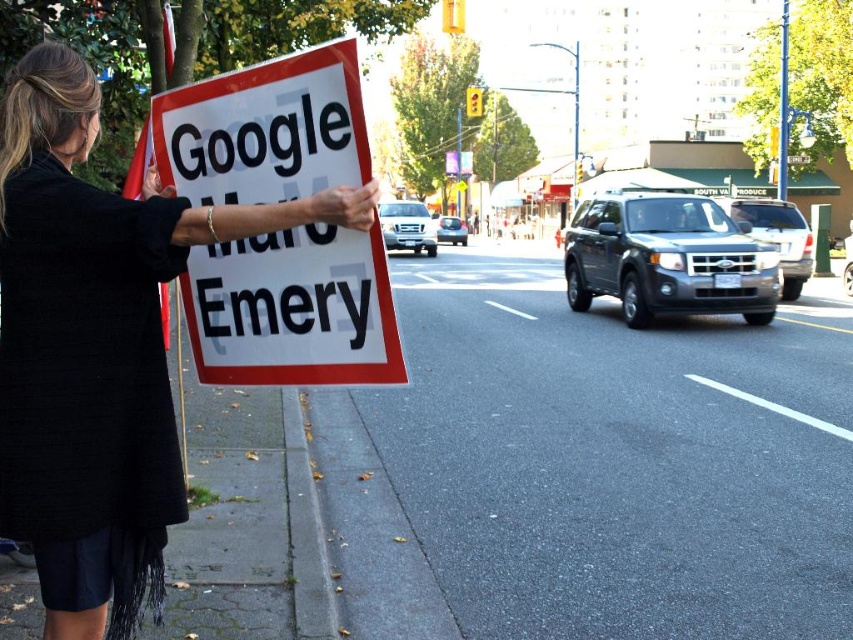
Question: Among these points, which one is nearest to the camera?

Choices:
 (A) (258, 236)
 (B) (3, 227)

Answer: (B)

Question: Which of the following is the farthest from the observer?

Choices:
 (A) [x=140, y=307]
 (B) [x=300, y=56]

Answer: (B)

Question: Considering the relative positions of black fabric dress at left and white paper sign at left in the image provided, where is black fabric dress at left located with respect to white paper sign at left?

Choices:
 (A) below
 (B) above

Answer: (A)

Question: Is black fabric dress at left in front of white paper sign at left?

Choices:
 (A) no
 (B) yes

Answer: (B)

Question: Does black fabric dress at left have a larger size compared to white paper sign at left?

Choices:
 (A) no
 (B) yes

Answer: (B)